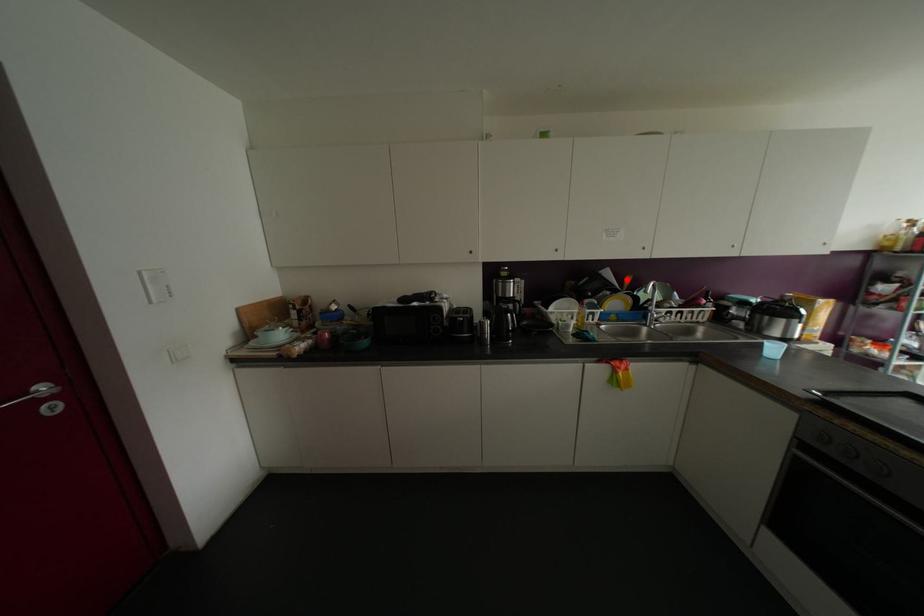
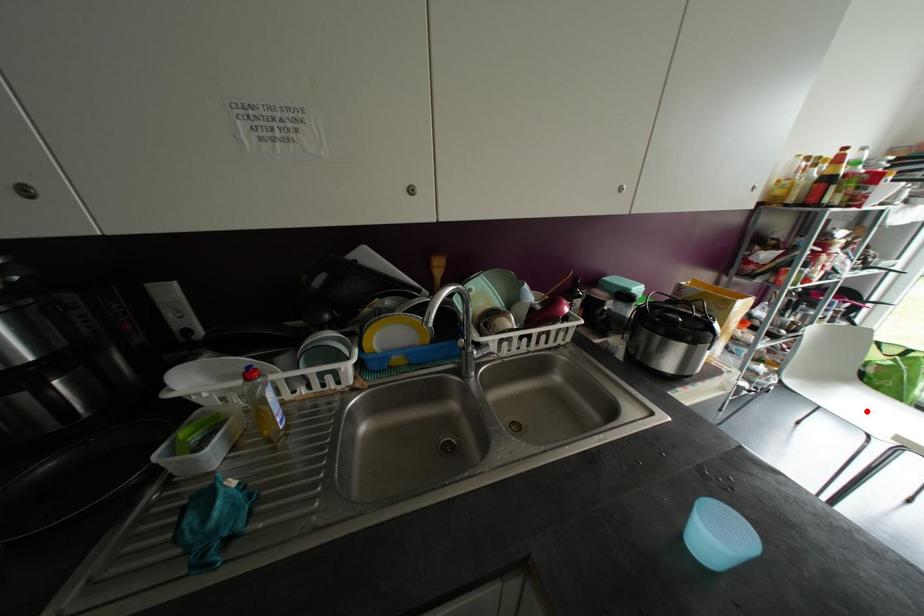
I am providing you with two images of the same scene from different viewpoints. A red point is marked on the first image and another point is marked on the second image. Do the highlighted points in image1 and image2 indicate the same real-world spot?

No